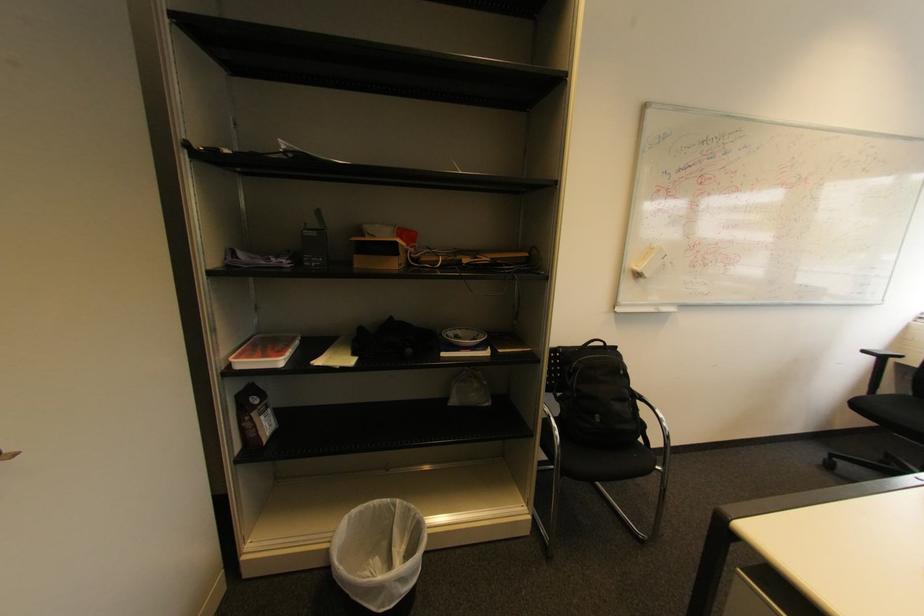
Find where to lift the white trash can. Please return your answer as a coordinate pair (x, y).

(379, 553)